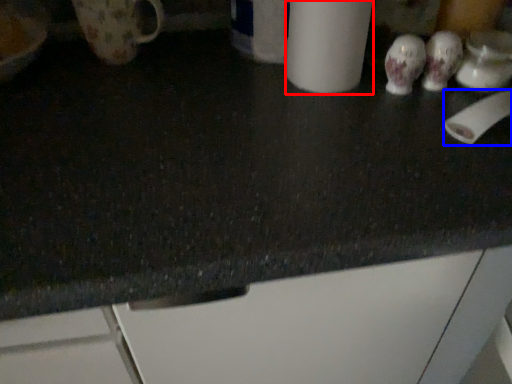
Question: Which point is further to the camera, paper towel (highlighted by a red box) or toilet paper (highlighted by a blue box)?

Choices:
 (A) paper towel
 (B) toilet paper

Answer: (B)